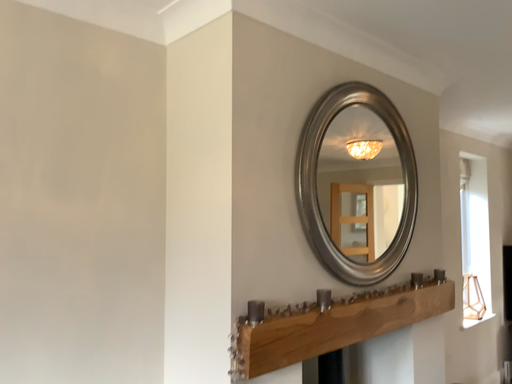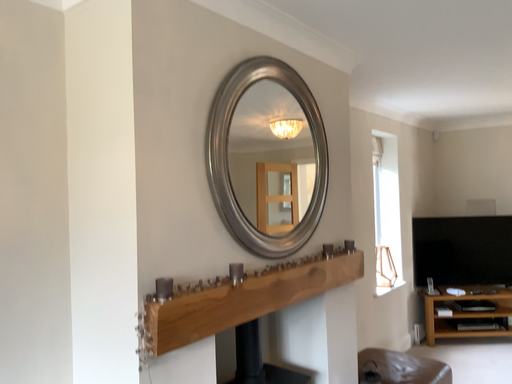
Question: How did the camera likely rotate when shooting the video?

Choices:
 (A) rotated left
 (B) rotated right

Answer: (B)